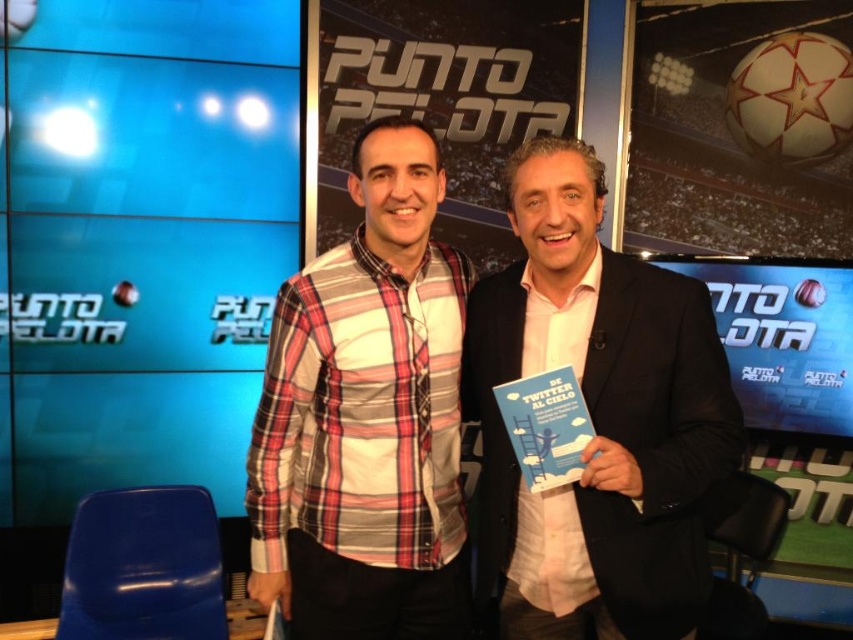
You are a photographer setting up for a photoshoot in a studio. You need to position a light source to the left of the plaid cotton shirt at center to highlight it. Will this light placement also illuminate the matte black suit at center?

The matte black suit at center is to the right of the plaid cotton shirt at center. Since the light is placed to the left of the plaid cotton shirt at center, the matte black suit at center will be illuminated as well because it is positioned to the right of the shirt, facing the light source.